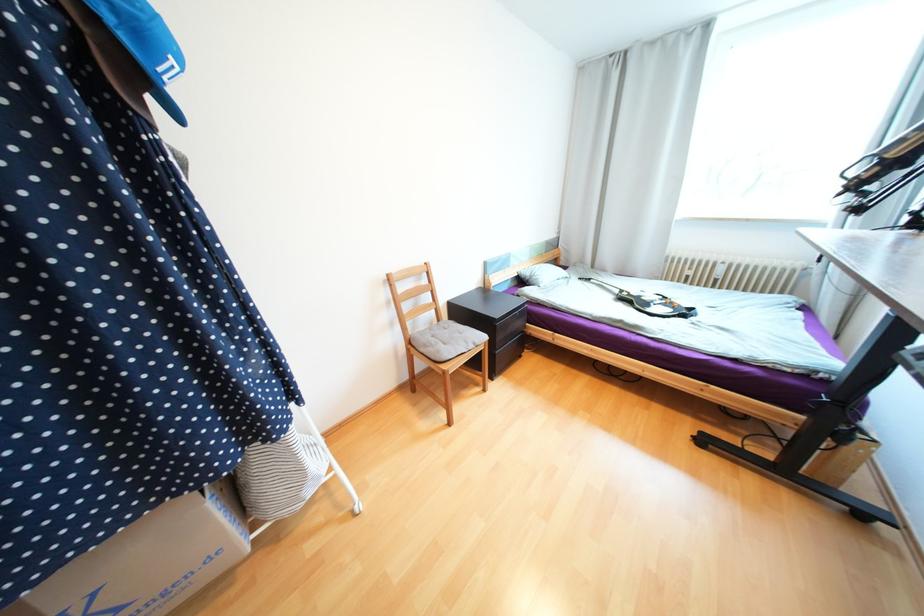
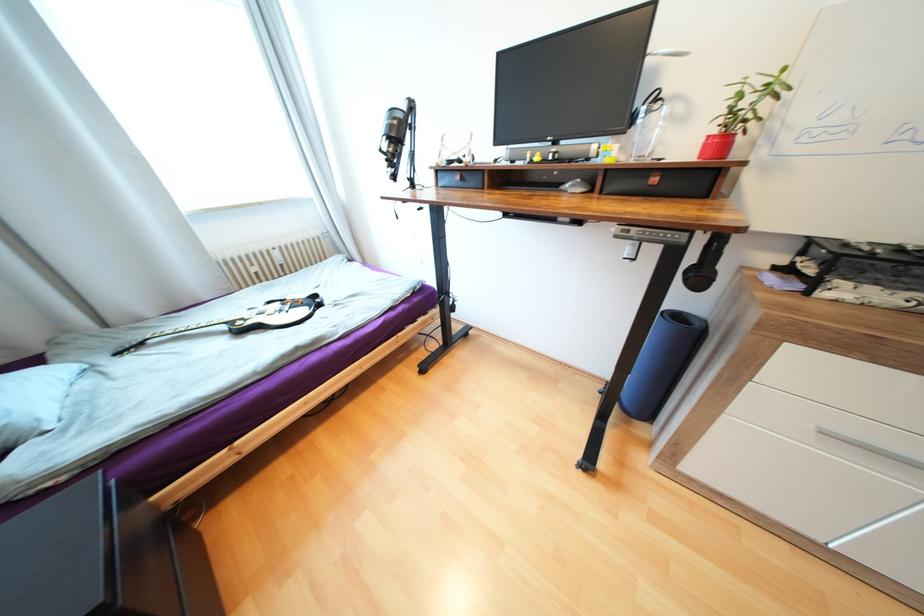
Where in the second image is the point corresponding to point 623,292 from the first image?

(229, 328)